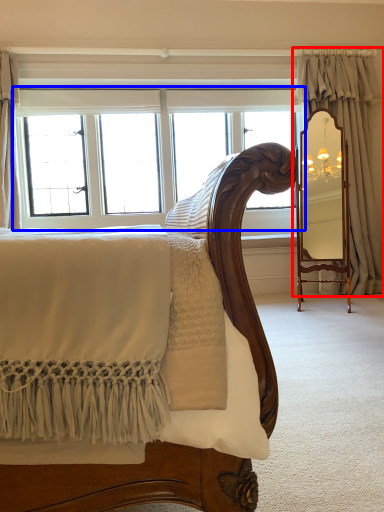
Question: Which object appears closest to the camera in this image, curtain (highlighted by a red box) or window (highlighted by a blue box)?

Choices:
 (A) curtain
 (B) window

Answer: (A)